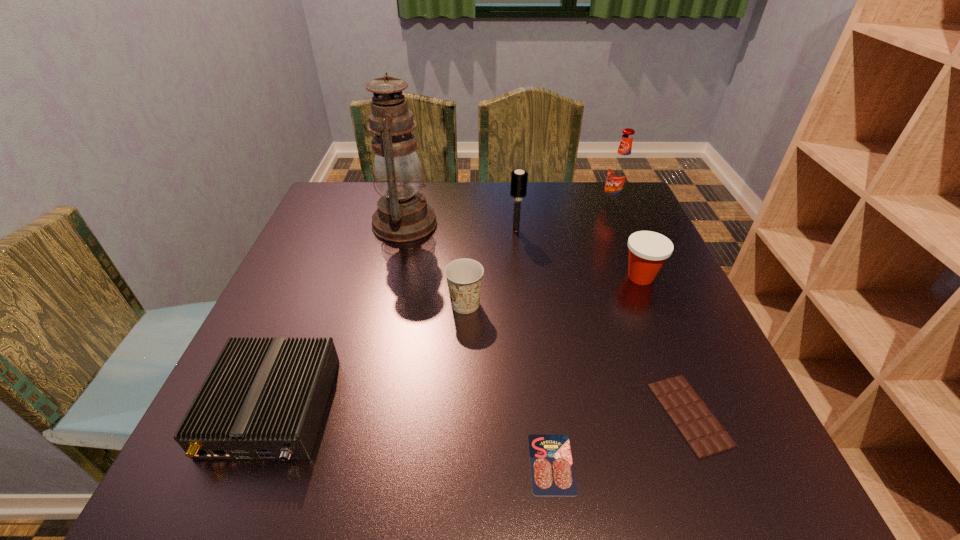
Locate an element on the screen. This screenshot has width=960, height=540. free space between the salami and the router is located at coordinates (x=412, y=436).

You are a GUI agent. You are given a task and a screenshot of the screen. Output one action in this format:
    pyautogui.click(x=<x>, y=<y>)
    Task: Click on the free space between the seventh shortest object and the shortest object
    
    Given the screenshot: What is the action you would take?
    pyautogui.click(x=582, y=335)

This screenshot has height=540, width=960. What are the coordinates of `free space between the second tallest object and the right Dixie cup` in the screenshot? It's located at (627, 241).

Locate an element on the screen. free space between the sixth shortest object and the shortest object is located at coordinates (534, 347).

Where is `free spot between the left Dixie cup and the shortest object`? This screenshot has width=960, height=540. free spot between the left Dixie cup and the shortest object is located at coordinates click(509, 384).

The height and width of the screenshot is (540, 960). I want to click on empty space between the fourth nearest object and the shortest object, so click(509, 384).

Locate an element on the screen. The height and width of the screenshot is (540, 960). unoccupied area between the third tallest object and the salami is located at coordinates (534, 347).

Locate which object ranks third in proximity to the root beer. Please provide its 2D coordinates. Your answer should be formatted as a tuple, i.e. [(x, y)], where the tuple contains the x and y coordinates of a point satisfying the conditions above.

[(403, 215)]

Identify which object is the closest to the third tallest object. Please provide its 2D coordinates. Your answer should be formatted as a tuple, i.e. [(x, y)], where the tuple contains the x and y coordinates of a point satisfying the conditions above.

[(403, 215)]

The image size is (960, 540). In order to click on vacant space that satisfies the following two spatial constraints: 1. on the back panel of the sixth tallest object; 2. on the left side of the second shortest object in this screenshot , I will do `click(270, 414)`.